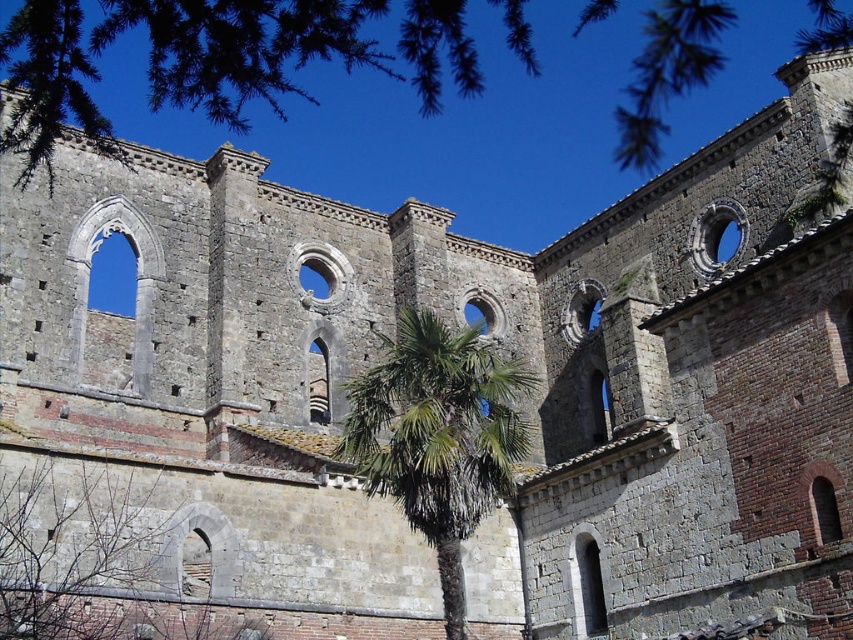
Between green leafy tree at upper center and green leafy palm at center, which one appears on the left side from the viewer's perspective?

From the viewer's perspective, green leafy tree at upper center appears more on the left side.

Who is positioned more to the right, green leafy tree at upper center or green leafy palm at center?

From the viewer's perspective, green leafy palm at center appears more on the right side.

At what (x,y) coordinates should I click in order to perform the action: click on green leafy tree at upper center. Please return your answer as a coordinate pair (x, y). Image resolution: width=853 pixels, height=640 pixels. Looking at the image, I should click on (219, 54).

This screenshot has width=853, height=640. What are the coordinates of `green leafy tree at upper center` in the screenshot? It's located at (219, 54).

Who is more distant from viewer, (36, 109) or (105, 540)?

The point (105, 540) is more distant.

Which is above, green leafy tree at upper center or green leafy palm at lower center?

Positioned higher is green leafy tree at upper center.

Which is behind, point (262, 17) or point (16, 580)?

Point (16, 580)

Identify the location of green leafy tree at upper center. (219, 54).

Can you confirm if green leafy palm at center is wider than green leafy palm at lower center?

Indeed, green leafy palm at center has a greater width compared to green leafy palm at lower center.

Is green leafy palm at center positioned before green leafy palm at lower center?

No.

This screenshot has height=640, width=853. I want to click on green leafy palm at center, so click(438, 435).